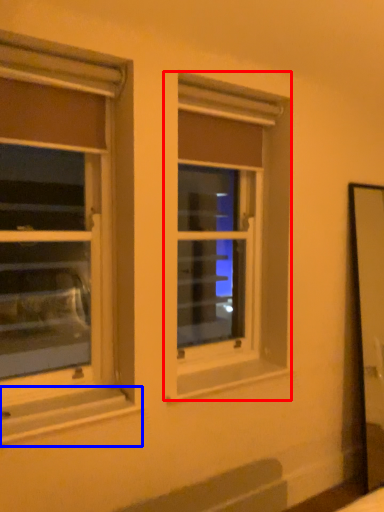
Question: Which of the following is the farthest to the observer, window (highlighted by a red box) or window sill (highlighted by a blue box)?

Choices:
 (A) window
 (B) window sill

Answer: (A)